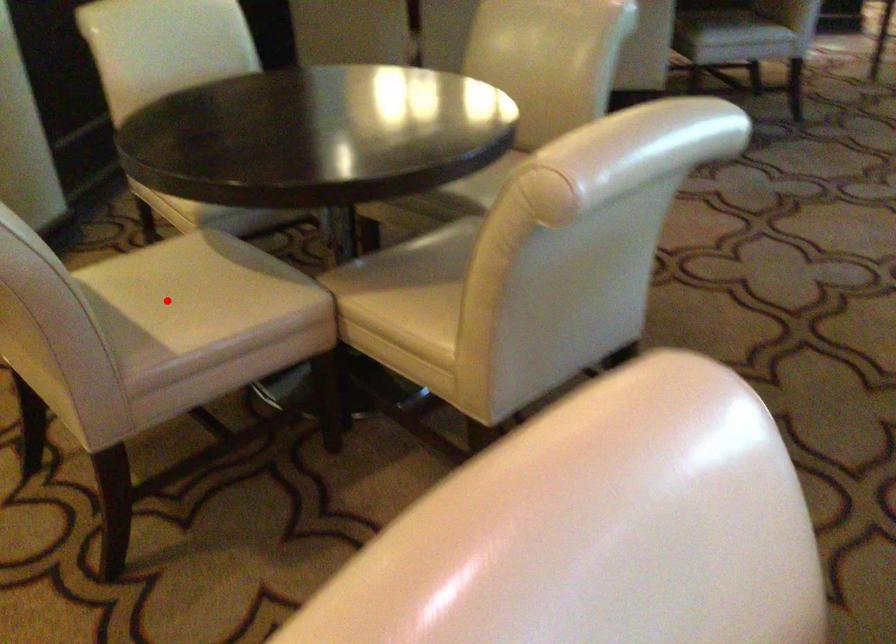
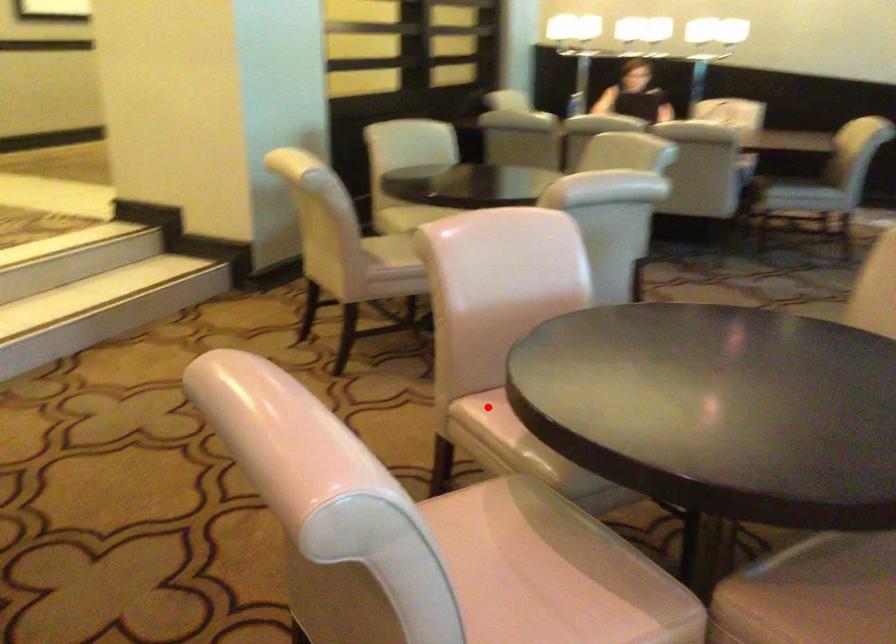
I am providing you with two images of the same scene from different viewpoints. A red point is marked on the first image and another point is marked on the second image. Are the points marked in image1 and image2 representing the same 3D position?

No